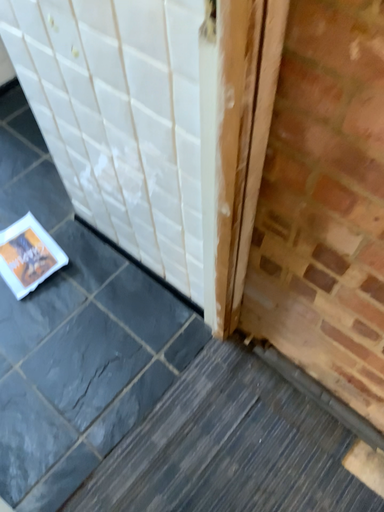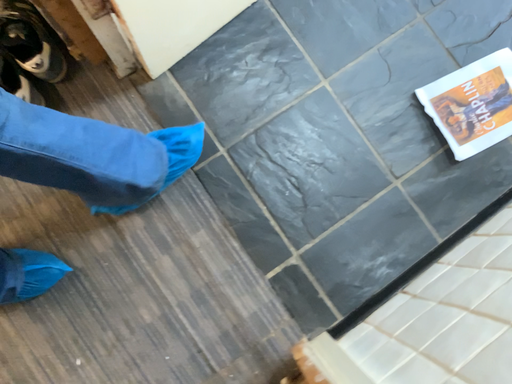
Question: How did the camera likely rotate when shooting the video?

Choices:
 (A) rotated left
 (B) rotated right

Answer: (A)